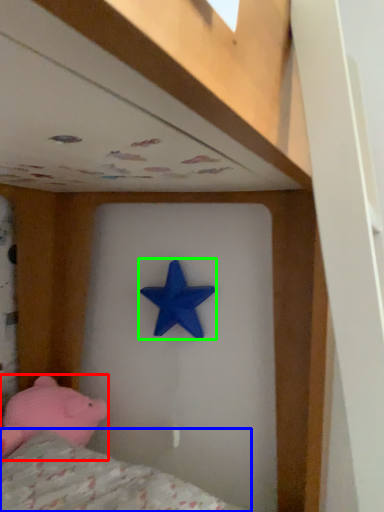
Question: Which object is the farthest from toy (highlighted by a red box)? Choose among these: mattress (highlighted by a blue box) or starfish (highlighted by a green box).

Choices:
 (A) mattress
 (B) starfish

Answer: (B)